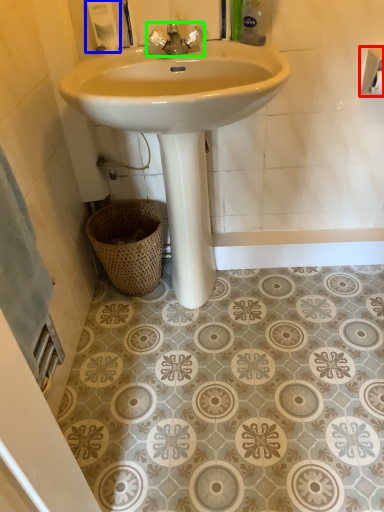
Question: Which object is positioned closest to toilet paper (highlighted by a red box)? Select from toiletry (highlighted by a blue box) and tap (highlighted by a green box).

Choices:
 (A) toiletry
 (B) tap

Answer: (B)